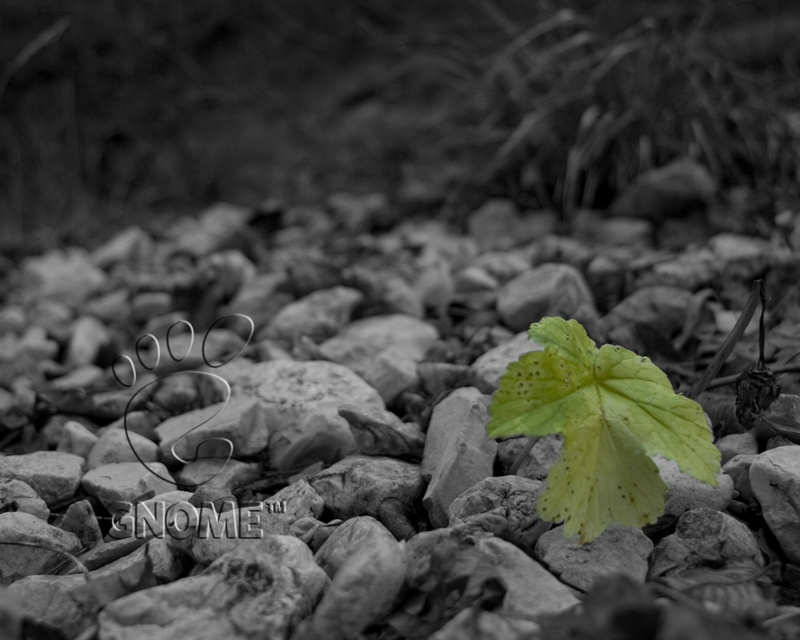
Based on the photo, you are a photographer adjusting your camera settings to focus on the smooth gray rock at center and the green matte leaf at center. Which object should you focus on first if you want to ensure both are in focus?

The smooth gray rock at center is closer to the viewer than the green matte leaf at center, so you should focus on the smooth gray rock at center first to ensure both are in focus.

You are an artist trying to paint this scene. You want to place a green matte leaf at center and a smooth gray rock at center in your painting. According to the scene, which object should you paint first to ensure proper layering?

The smooth gray rock at center should be painted first because it is above the green matte leaf at center in the scene, so it needs to be layered on top.